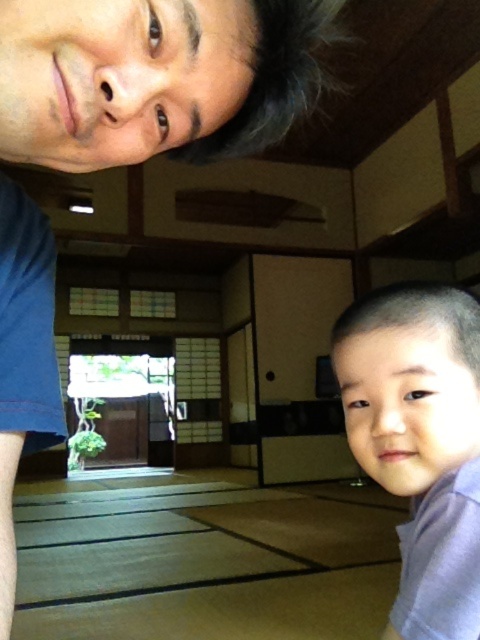
Question: Can you confirm if matte black hair at upper center is positioned below light purple fabric at lower right?

Choices:
 (A) no
 (B) yes

Answer: (A)

Question: Based on their relative distances, which object is farther from the matte black hair at upper center?

Choices:
 (A) matte blue shirt at upper left
 (B) light purple fabric at lower right

Answer: (B)

Question: Which of the following is the farthest from the observer?

Choices:
 (A) light purple fabric at lower right
 (B) matte blue shirt at upper left

Answer: (A)

Question: Which of the following is the closest to the observer?

Choices:
 (A) (156, 80)
 (B) (178, 108)

Answer: (A)

Question: Is matte blue shirt at upper left wider than light purple fabric at lower right?

Choices:
 (A) no
 (B) yes

Answer: (B)

Question: Is matte blue shirt at upper left below light purple fabric at lower right?

Choices:
 (A) no
 (B) yes

Answer: (A)